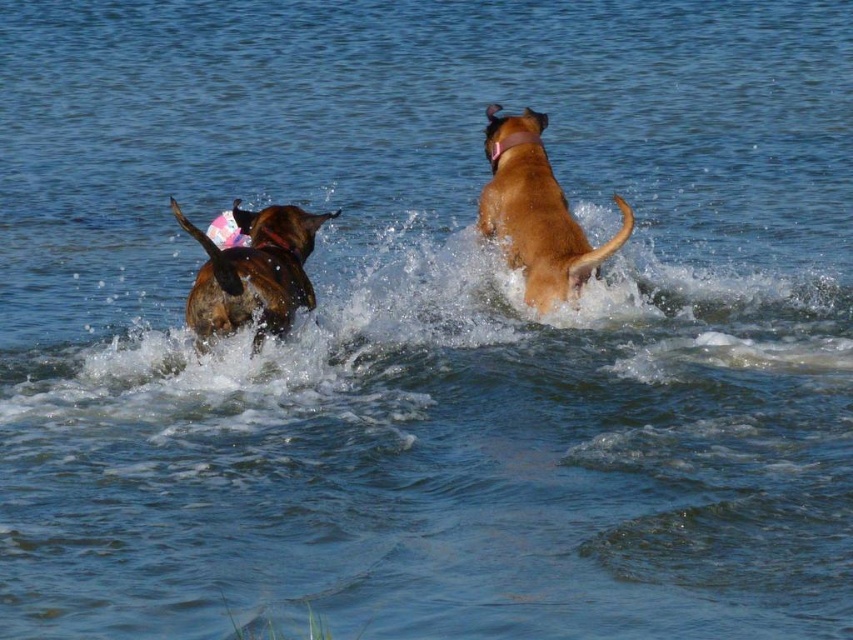
Question: Among these points, which one is nearest to the camera?

Choices:
 (A) (546, 168)
 (B) (288, 284)

Answer: (B)

Question: Can you confirm if brown matte dog at upper right is positioned below brown matte dog at left?

Choices:
 (A) yes
 (B) no

Answer: (B)

Question: Which point appears closest to the camera in this image?

Choices:
 (A) (582, 240)
 (B) (252, 276)

Answer: (B)

Question: Does brown matte dog at upper right appear on the right side of brown matte dog at left?

Choices:
 (A) no
 (B) yes

Answer: (B)

Question: Does brown matte dog at upper right lie in front of brown matte dog at left?

Choices:
 (A) no
 (B) yes

Answer: (A)